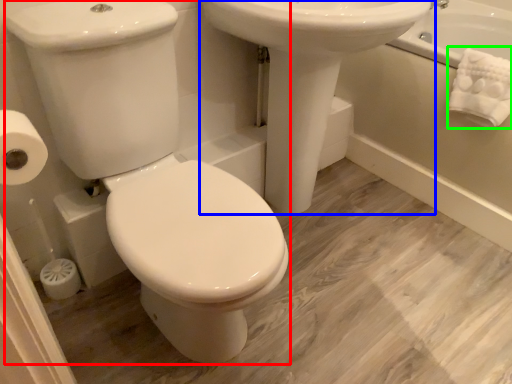
Question: Which object is positioned closest to porcelain (highlighted by a red box)? Select from sink (highlighted by a blue box) and bath towel (highlighted by a green box).

Choices:
 (A) sink
 (B) bath towel

Answer: (A)